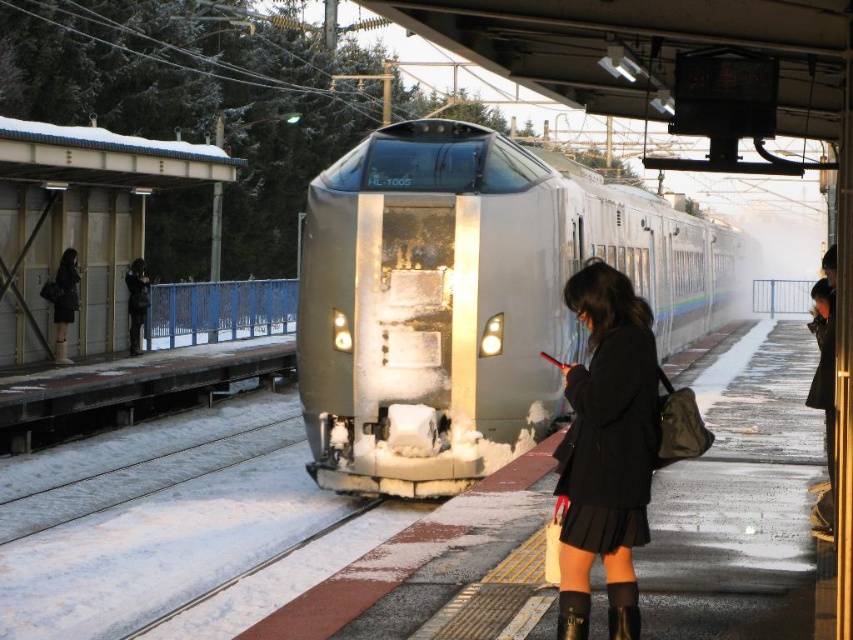
You are a passenger waiting for the HL 1005 bullet train at the snowy platform. You notice a matte black coat at left and a black leather boot at lower center. Which object is positioned higher from the ground?

The matte black coat at left is above the black leather boot at lower center, so it is positioned higher from the ground.

You are a passenger waiting for your train at the train station platform. You notice two coats hanging on the coat rack. One is labeled as the black matte coat at center and the other is the matte black coat at left. Which coat is positioned to the right when facing the coat rack?

The black matte coat at center is positioned to the right of the matte black coat at left when facing the coat rack.